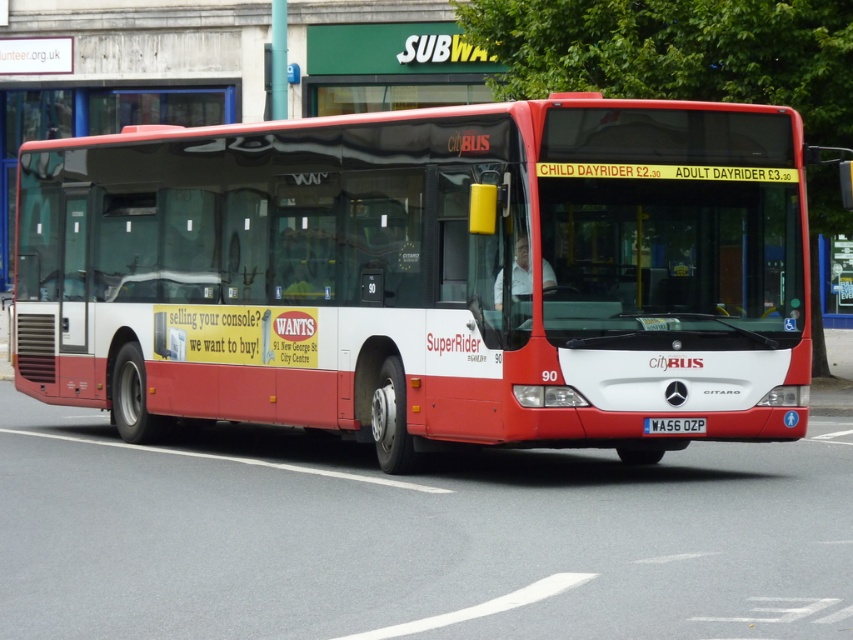
Identify the location of matte red bus at center. The image size is (853, 640). (427, 275).

Can you confirm if matte red bus at center is positioned below white plastic license plate at center?

No, matte red bus at center is not below white plastic license plate at center.

Who is more distant from viewer, (706, 221) or (668, 429)?

Point (706, 221)

The image size is (853, 640). What are the coordinates of `matte red bus at center` in the screenshot? It's located at (427, 275).